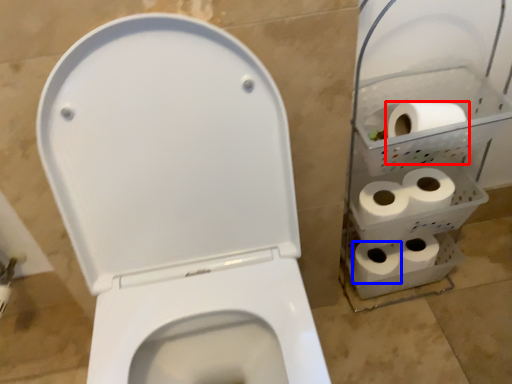
Question: Which of the following is the closest to the observer, toilet paper (highlighted by a red box) or toilet paper (highlighted by a blue box)?

Choices:
 (A) toilet paper
 (B) toilet paper

Answer: (A)